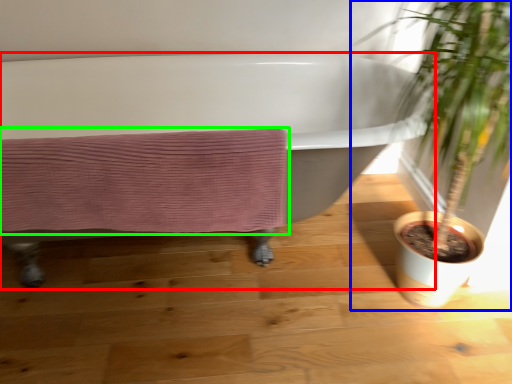
Question: Considering the real-world distances, which object is closest to bathtub (highlighted by a red box)? houseplant (highlighted by a blue box) or bath towel (highlighted by a green box).

Choices:
 (A) houseplant
 (B) bath towel

Answer: (A)